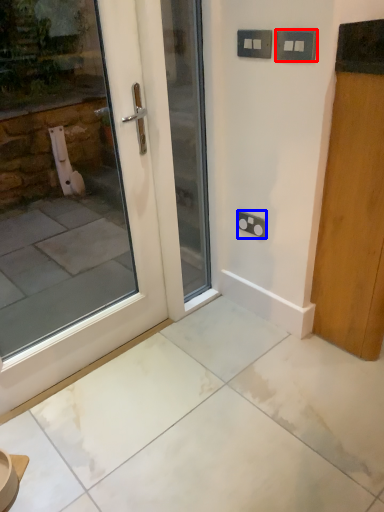
Question: Which object appears closest to the camera in this image, electric outlet (highlighted by a red box) or electric outlet (highlighted by a blue box)?

Choices:
 (A) electric outlet
 (B) electric outlet

Answer: (A)